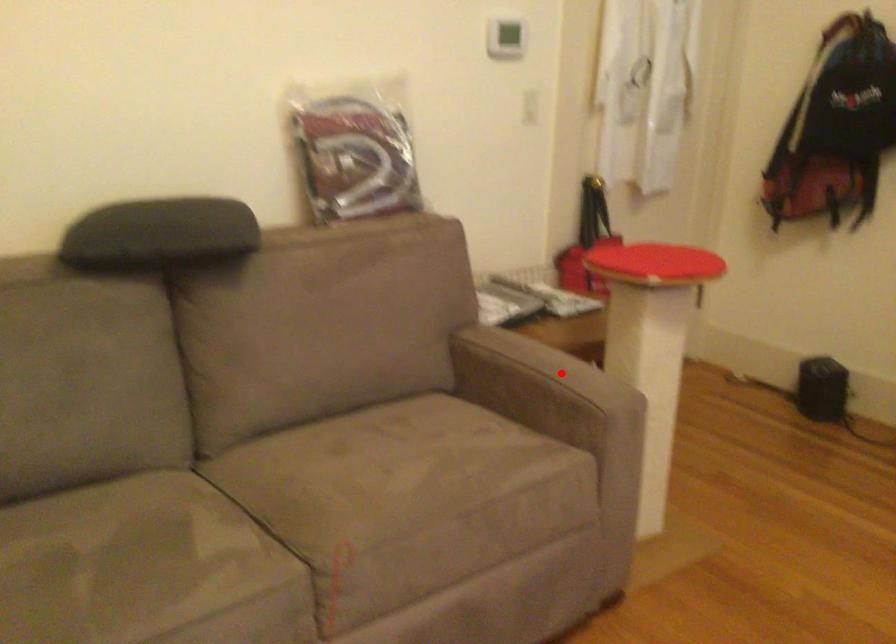
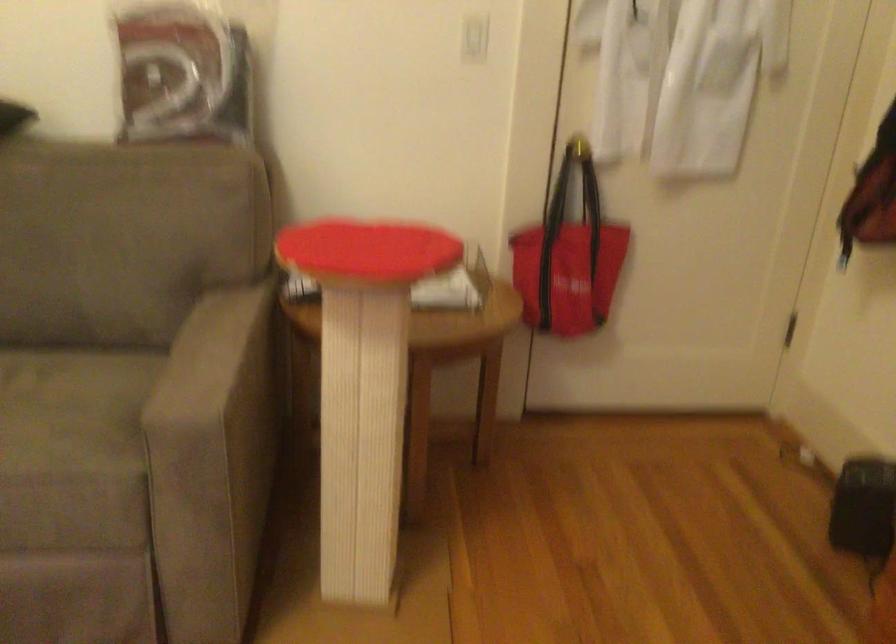
The point at the highlighted location is marked in the first image. Where is the corresponding point in the second image?

(212, 360)